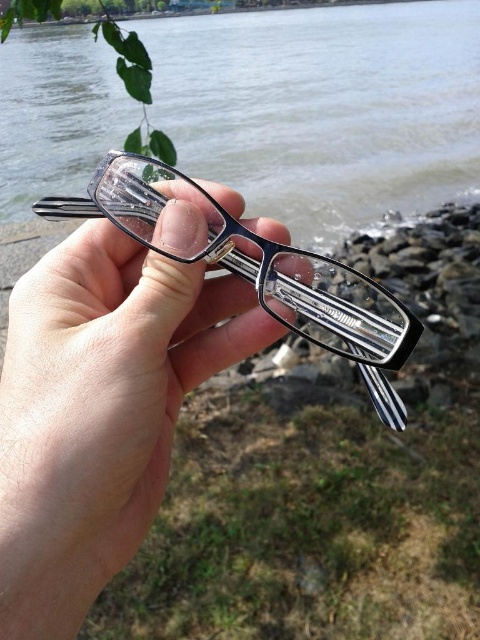
How far apart are transparent plastic water at center and clear plastic glasses at center?

1.73 meters

Between transparent plastic water at center and clear plastic glasses at center, which one has less height?

clear plastic glasses at center

Measure the distance between point (250, 188) and camera.

6.73 feet

The image size is (480, 640). I want to click on transparent plastic water at center, so click(324, 108).

Can you confirm if clear plastic glasses at center is wider than matte black glasses at center?

No, clear plastic glasses at center is not wider than matte black glasses at center.

From the picture: Does clear plastic glasses at center appear on the left side of matte black glasses at center?

Indeed, clear plastic glasses at center is positioned on the left side of matte black glasses at center.

Find the location of `clear plastic glasses at center`. clear plastic glasses at center is located at coordinates (99, 412).

Is transparent plastic water at center to the right of matte black glasses at center from the viewer's perspective?

Indeed, transparent plastic water at center is positioned on the right side of matte black glasses at center.

What do you see at coordinates (324, 108) in the screenshot? The width and height of the screenshot is (480, 640). I see `transparent plastic water at center` at bounding box center [324, 108].

What do you see at coordinates (324, 108) in the screenshot? The height and width of the screenshot is (640, 480). I see `transparent plastic water at center` at bounding box center [324, 108].

Identify the location of transparent plastic water at center. (324, 108).